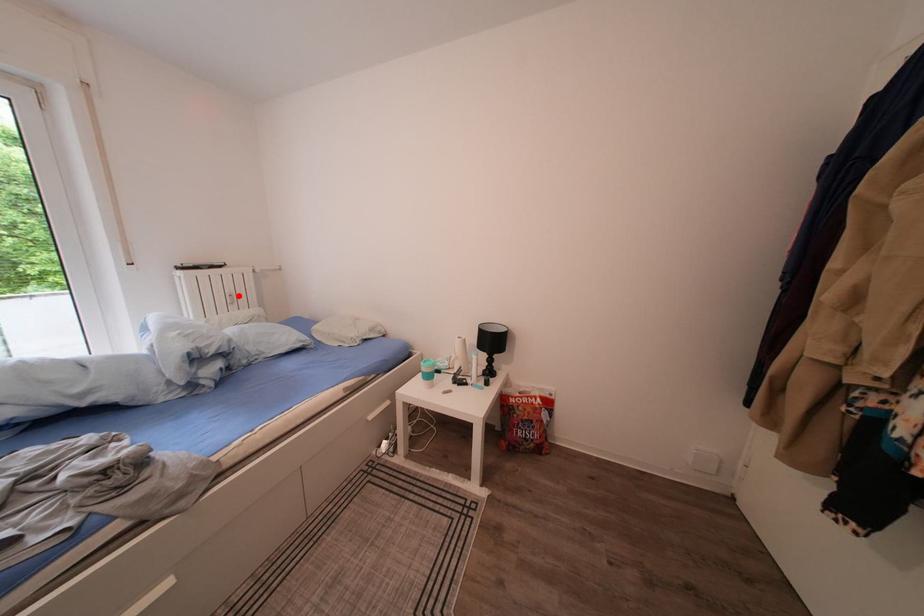
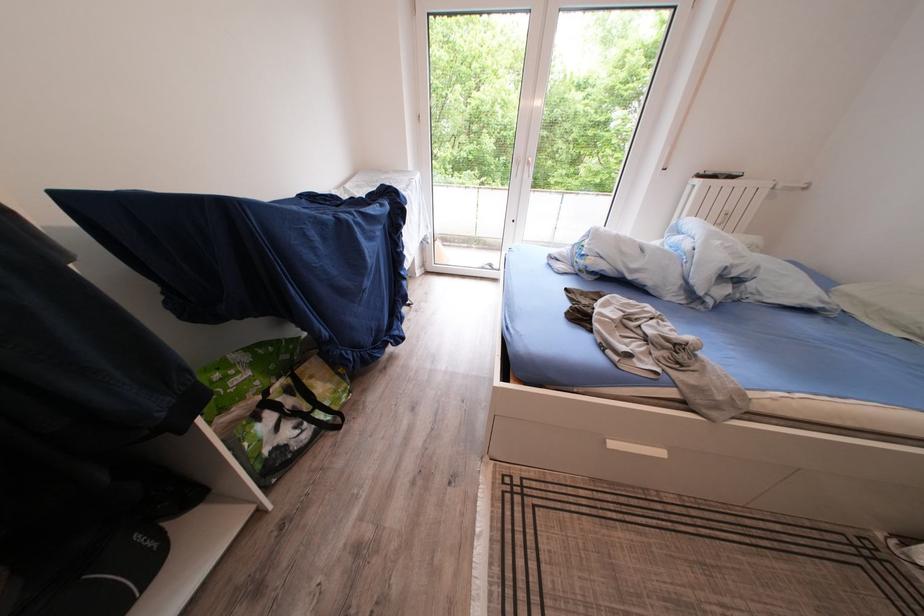
Question: A red point is marked in image1. In image2, is the corresponding 3D point closer to the camera or farther? Reply with the corresponding letter.

Choices:
 (A) The corresponding 3D point is closer.
 (B) The corresponding 3D point is farther.

Answer: (B)